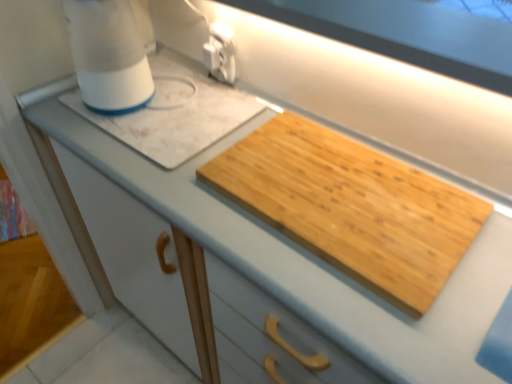
Find the location of a particular element. The width and height of the screenshot is (512, 384). vacant space to the left of white plastic electric outlet at upper center is located at coordinates (x=173, y=85).